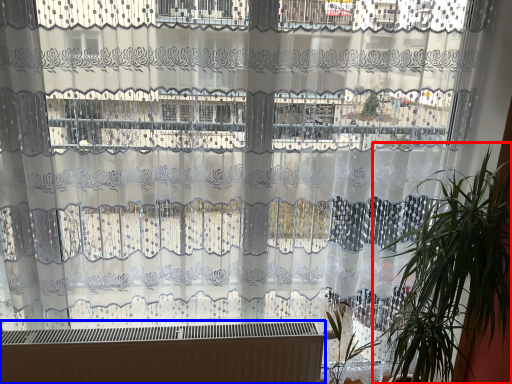
Question: Which object appears closest to the camera in this image, houseplant (highlighted by a red box) or heater (highlighted by a blue box)?

Choices:
 (A) houseplant
 (B) heater

Answer: (A)